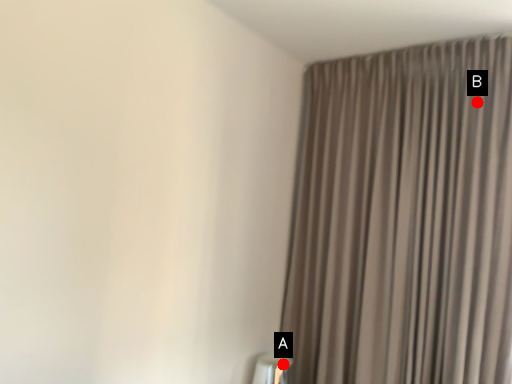
Question: Two points are circled on the image, labeled by A and B beside each circle. Which point appears closest to the camera in this image?

Choices:
 (A) A is closer
 (B) B is closer

Answer: (B)